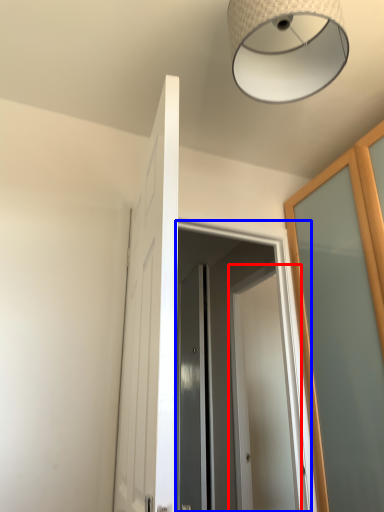
Question: Which object is further to the camera taking this photo, door (highlighted by a red box) or screen door (highlighted by a blue box)?

Choices:
 (A) door
 (B) screen door

Answer: (A)